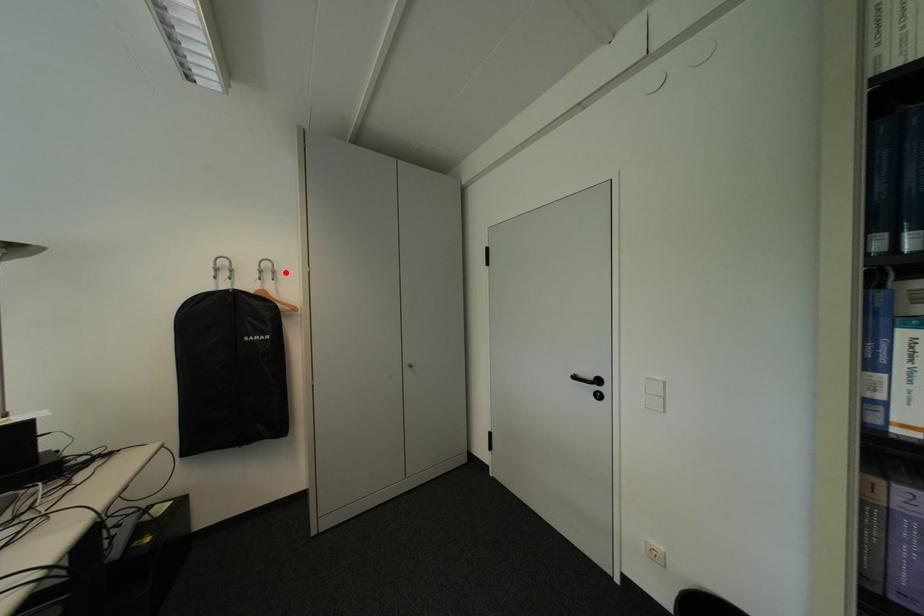
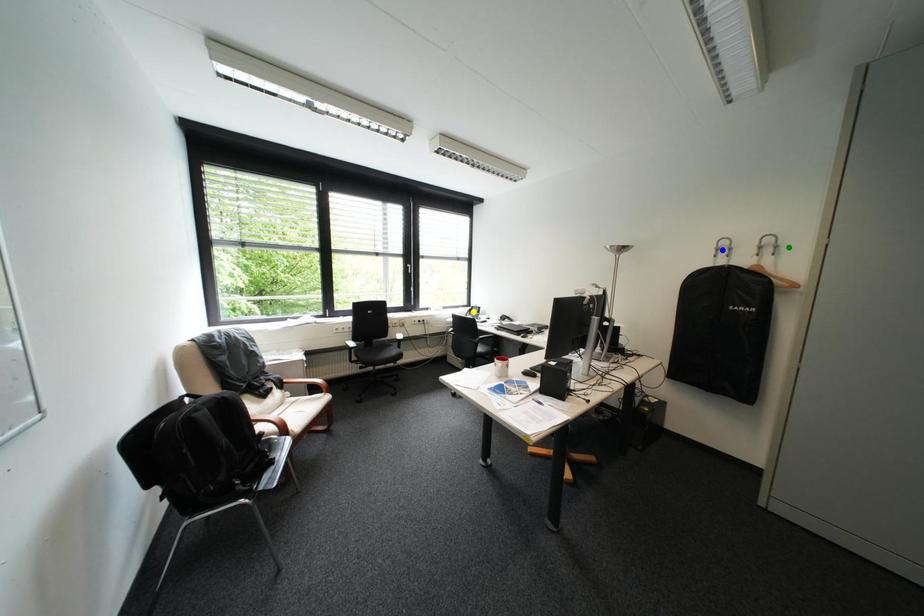
Question: I am providing you with two images of the same scene from different viewpoints. A red point is marked on the first image. You are given multiple points on the second image. Which point in image 2 is actually the same real-world point as the red point in image 1?

Choices:
 (A) blue point
 (B) green point
 (C) yellow point

Answer: (B)